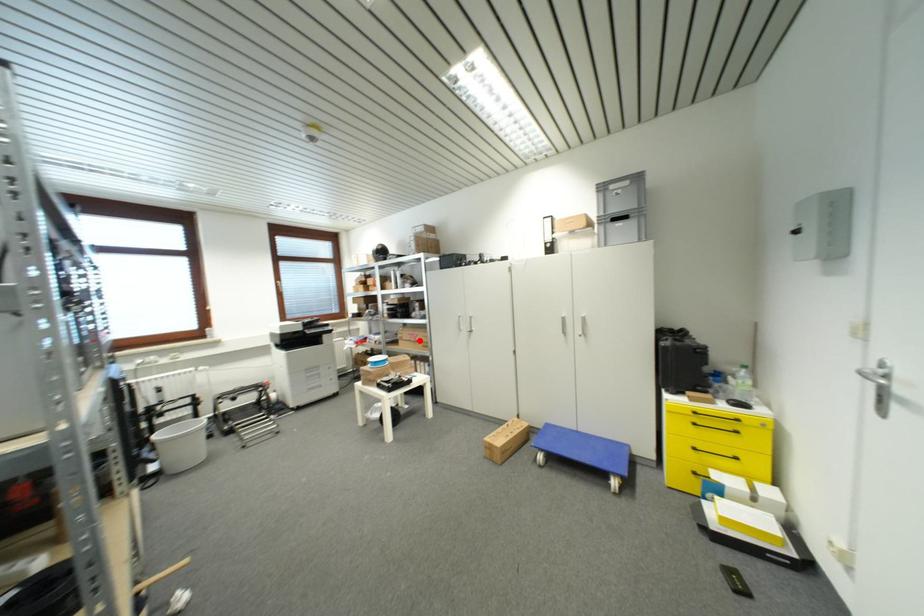
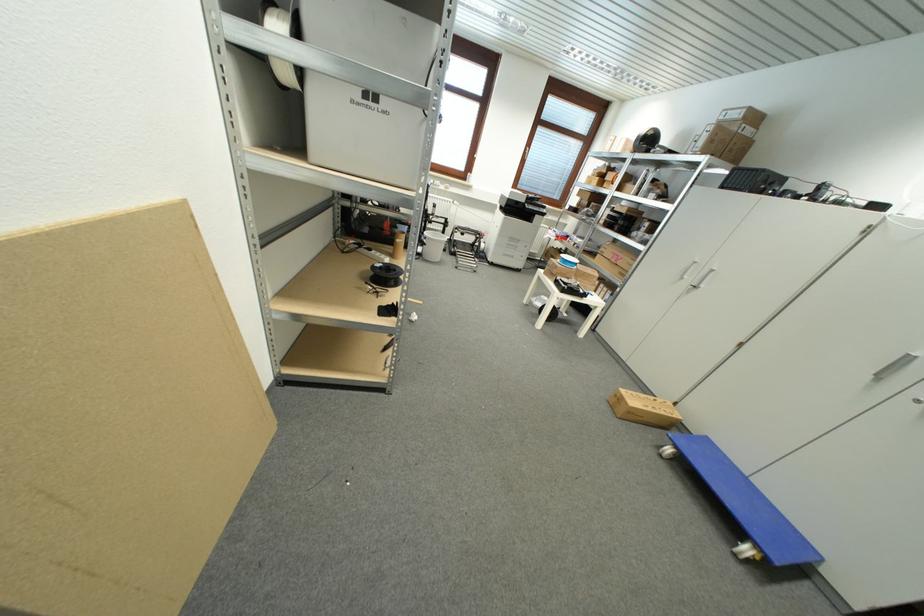
Find the pixel in the second image that matches the highlighted location in the first image.

(621, 262)